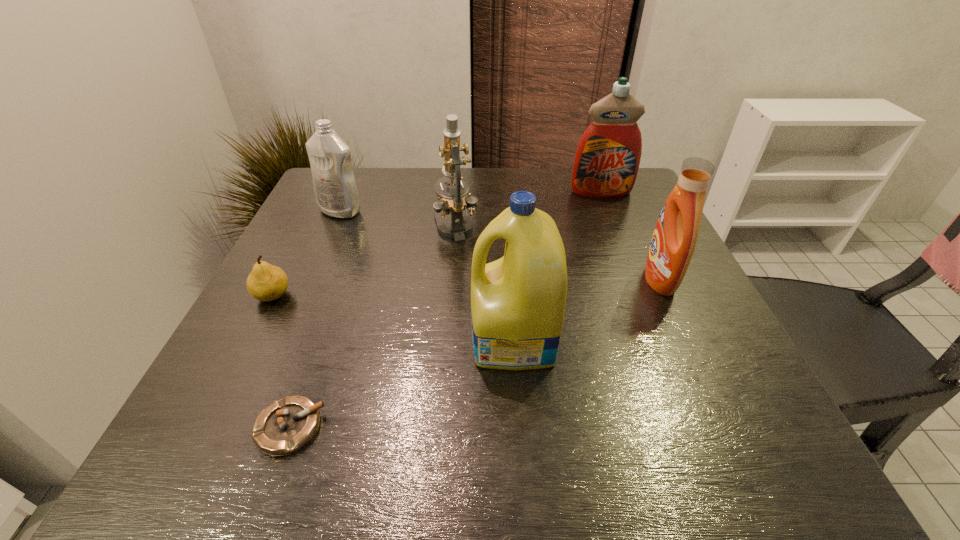
The height and width of the screenshot is (540, 960). I want to click on vacant space located on the label of the third detergent from right to left, so click(335, 340).

Where is `vacant space located on the label of the third detergent from right to left`? This screenshot has height=540, width=960. vacant space located on the label of the third detergent from right to left is located at coordinates (302, 340).

Identify the location of free space located on the label of the third detergent from right to left. (400, 340).

Locate an element on the screen. free space located on the back of the microscope is located at coordinates (460, 172).

Locate an element on the screen. Image resolution: width=960 pixels, height=540 pixels. free spot located on the front-facing side of the third farthest detergent is located at coordinates (476, 280).

At what (x,y) coordinates should I click in order to perform the action: click on vacant space located 0.230m on the front-facing side of the third farthest detergent. Please return your answer as a coordinate pair (x, y). Image resolution: width=960 pixels, height=540 pixels. Looking at the image, I should click on [x=538, y=280].

Locate an element on the screen. vacant space situated 0.370m on the front-facing side of the third farthest detergent is located at coordinates (471, 280).

Locate an element on the screen. free space located on the front of the leftmost detergent is located at coordinates (283, 342).

Find the location of a particular element. Image resolution: width=960 pixels, height=540 pixels. vacant space located on the back of the pear is located at coordinates (293, 257).

The width and height of the screenshot is (960, 540). I want to click on free space located 0.320m on the back of the shortest object, so click(345, 272).